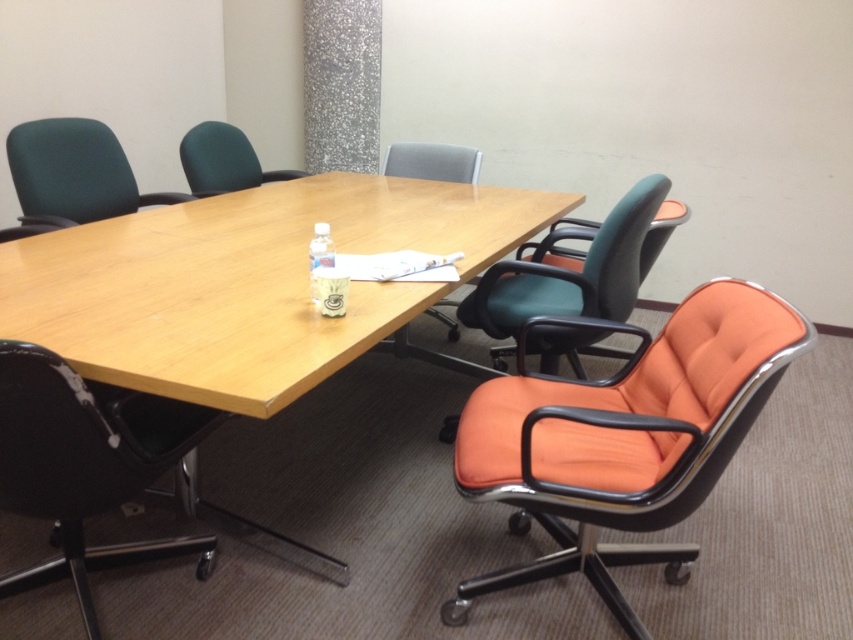
You are sitting in the matte green office chair at upper left and want to reach the wooden table at center to grab a document. Is the table positioned in a way that requires you to move forward or backward from your current position?

The wooden table at center is located below the matte green office chair at upper left, so you would need to move forward from your current position to reach it.